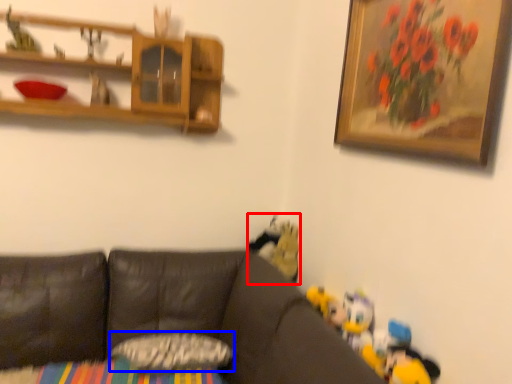
Question: Which point is closer to the camera, toy (highlighted by a red box) or pillow (highlighted by a blue box)?

Choices:
 (A) toy
 (B) pillow

Answer: (B)